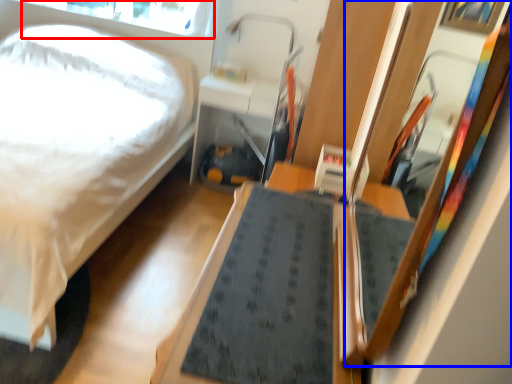
Question: Which object appears farthest to the camera in this image, window screen (highlighted by a red box) or mirror (highlighted by a blue box)?

Choices:
 (A) window screen
 (B) mirror

Answer: (A)